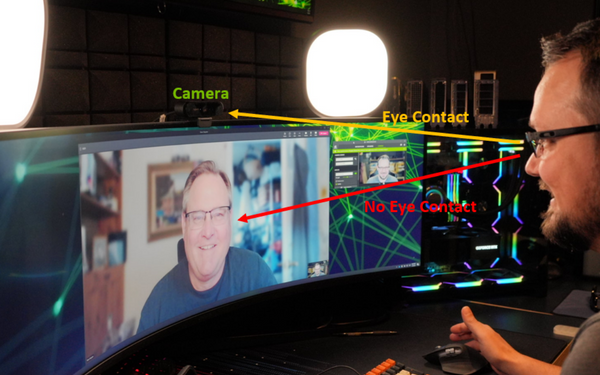
Where is `mouse`? The image size is (600, 375). mouse is located at coordinates (460, 351).